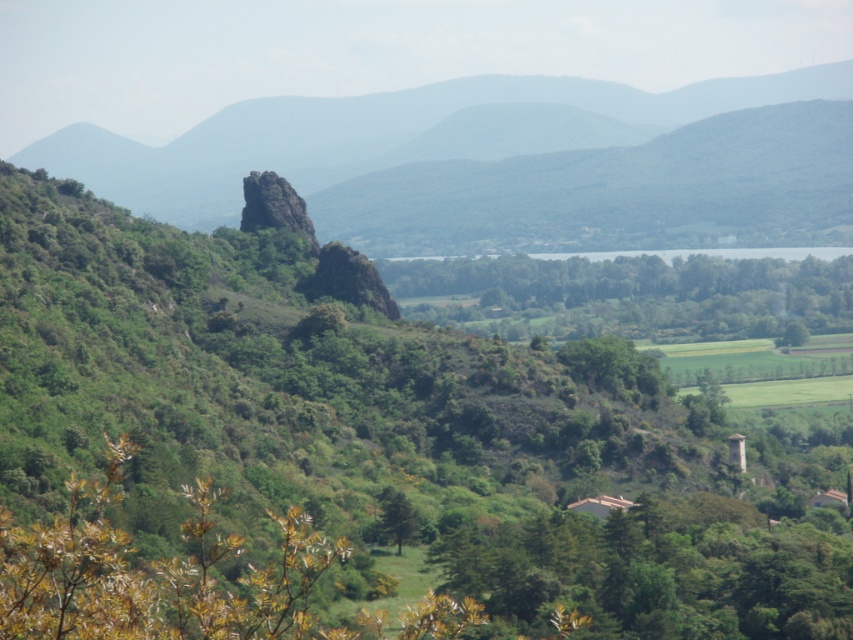
You are an explorer navigating through this landscape and need to reach the green matte tree at center. From your current position, which direction should you move relative to the rugged stone mountain at center to reach it?

The green matte tree at center is behind the rugged stone mountain at center, so you should move away from the rugged stone mountain at center to reach it.

You are a hiker planning to take a photo of the rugged stone mountain at center and the green matte tree at center. Which object should you focus on first if you want to capture both in a single frame without moving the camera?

You should focus on the rugged stone mountain at center first because it is above the green matte tree at center, so adjusting focus to the mountain ensures both will be in the frame.